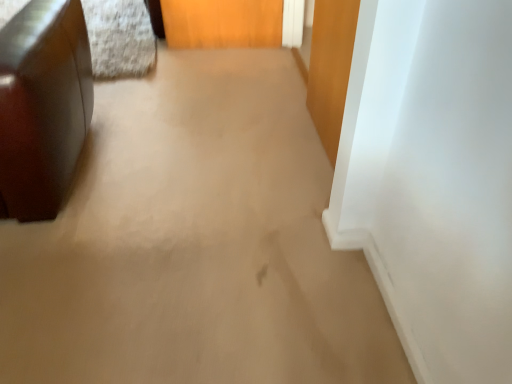
Measure the distance between wooden door at upper right and camera.

wooden door at upper right is 1.22 meters from camera.

Where is `wooden door at upper right`? Image resolution: width=512 pixels, height=384 pixels. wooden door at upper right is located at coordinates (330, 68).

The height and width of the screenshot is (384, 512). Describe the element at coordinates (330, 68) in the screenshot. I see `wooden door at upper right` at that location.

Measure the distance between point (321,87) and camera.

Point (321,87) and camera are 6.42 feet apart from each other.

Consider the image. Measure the distance between point (22, 207) and camera.

A distance of 5.34 feet exists between point (22, 207) and camera.

What do you see at coordinates (42, 106) in the screenshot? The width and height of the screenshot is (512, 384). I see `glossy brown ottoman at left` at bounding box center [42, 106].

This screenshot has height=384, width=512. In order to click on glossy brown ottoman at left in this screenshot , I will do `click(42, 106)`.

Find the location of a particular element. The height and width of the screenshot is (384, 512). wooden door at upper right is located at coordinates (330, 68).

Considering the positions of objects glossy brown ottoman at left and wooden door at upper right in the image provided, who is more to the right, glossy brown ottoman at left or wooden door at upper right?

wooden door at upper right.

Considering the positions of objects glossy brown ottoman at left and wooden door at upper right in the image provided, who is in front, glossy brown ottoman at left or wooden door at upper right?

glossy brown ottoman at left.

Is point (23, 52) less distant than point (334, 116)?

That is True.

From the image's perspective, relative to wooden door at upper right, is glossy brown ottoman at left above or below?

glossy brown ottoman at left is situated lower than wooden door at upper right in the image.

From a real-world perspective, is glossy brown ottoman at left positioned above or below wooden door at upper right?

In terms of real-world spatial position, glossy brown ottoman at left is above wooden door at upper right.

Looking at their sizes, would you say glossy brown ottoman at left is wider or thinner than wooden door at upper right?

Considering their sizes, glossy brown ottoman at left looks broader than wooden door at upper right.

Can you confirm if glossy brown ottoman at left is shorter than wooden door at upper right?

In fact, glossy brown ottoman at left may be taller than wooden door at upper right.

Considering the relative sizes of glossy brown ottoman at left and wooden door at upper right in the image provided, is glossy brown ottoman at left smaller than wooden door at upper right?

No, glossy brown ottoman at left is not smaller than wooden door at upper right.

Is wooden door at upper right surrounded by glossy brown ottoman at left?

No.

Does glossy brown ottoman at left touch wooden door at upper right?

glossy brown ottoman at left is not next to wooden door at upper right, and they're not touching.

Is glossy brown ottoman at left oriented away from wooden door at upper right?

No, glossy brown ottoman at left is not facing away from wooden door at upper right.

How many degrees apart are the facing directions of glossy brown ottoman at left and wooden door at upper right?

90.7 degrees.

How much distance is there between glossy brown ottoman at left and wooden door at upper right?

3.45 feet.

At what (x,y) coordinates should I click in order to perform the action: click on furniture to the left of wooden door at upper right. Please return your answer as a coordinate pair (x, y). Looking at the image, I should click on pos(42,106).

Considering the relative positions of wooden door at upper right and glossy brown ottoman at left in the image provided, is wooden door at upper right to the right of glossy brown ottoman at left from the viewer's perspective?

Correct, you'll find wooden door at upper right to the right of glossy brown ottoman at left.

Is the position of wooden door at upper right less distant than that of glossy brown ottoman at left?

No, the depth of wooden door at upper right is greater than that of glossy brown ottoman at left.

Considering the positions of point (321, 116) and point (88, 76), is point (321, 116) closer or farther from the camera than point (88, 76)?

Point (321, 116) appears to be farther away from the viewer than point (88, 76).

From the image's perspective, is wooden door at upper right located beneath glossy brown ottoman at left?

No.

From a real-world perspective, who is located higher, wooden door at upper right or glossy brown ottoman at left?

From a 3D spatial view, glossy brown ottoman at left is above.

Considering the relative sizes of wooden door at upper right and glossy brown ottoman at left in the image provided, is wooden door at upper right wider than glossy brown ottoman at left?

In fact, wooden door at upper right might be narrower than glossy brown ottoman at left.

Which of these two, wooden door at upper right or glossy brown ottoman at left, stands taller?

glossy brown ottoman at left is taller.

Can you confirm if wooden door at upper right is bigger than glossy brown ottoman at left?

A: Actually, wooden door at upper right might be smaller than glossy brown ottoman at left.

Is glossy brown ottoman at left completely or partially inside wooden door at upper right?

No, wooden door at upper right does not contain glossy brown ottoman at left.

Is wooden door at upper right beside glossy brown ottoman at left?

No, wooden door at upper right is not beside glossy brown ottoman at left.

Is wooden door at upper right looking in the opposite direction of glossy brown ottoman at left?

That's not correct — wooden door at upper right is not looking away from glossy brown ottoman at left.

Find the location of a particular element. The height and width of the screenshot is (384, 512). door located on the right of glossy brown ottoman at left is located at coordinates (330, 68).

In order to click on furniture below the wooden door at upper right (from the image's perspective) in this screenshot , I will do `click(42, 106)`.

Image resolution: width=512 pixels, height=384 pixels. What are the coordinates of `furniture above the wooden door at upper right (from a real-world perspective)` in the screenshot? It's located at (42, 106).